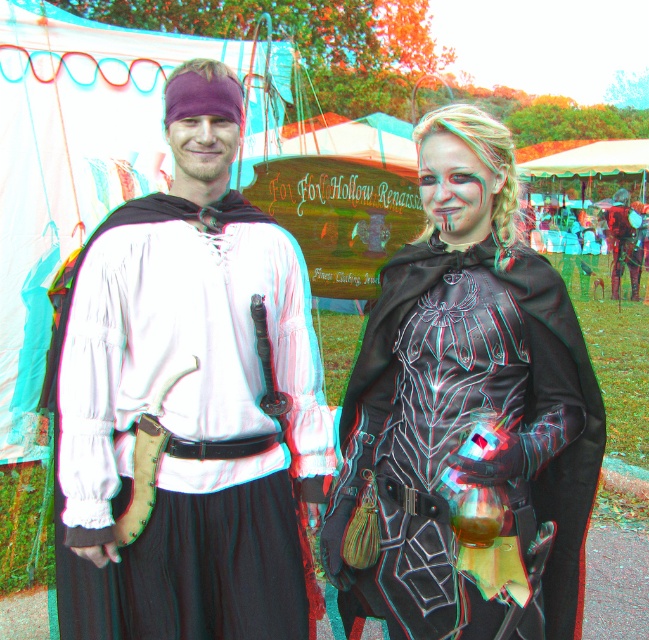
Question: Can you confirm if matte white shirt at center is positioned to the right of black leather cape at center?

Choices:
 (A) no
 (B) yes

Answer: (A)

Question: Can you confirm if matte white shirt at center is positioned below black leather cape at center?

Choices:
 (A) yes
 (B) no

Answer: (B)

Question: Among these points, which one is farthest from the camera?

Choices:
 (A) (567, 372)
 (B) (228, 241)

Answer: (B)

Question: Is matte white shirt at center bigger than black leather cape at center?

Choices:
 (A) no
 (B) yes

Answer: (A)

Question: Which point is closer to the camera?

Choices:
 (A) matte white shirt at center
 (B) black leather cape at center

Answer: (B)